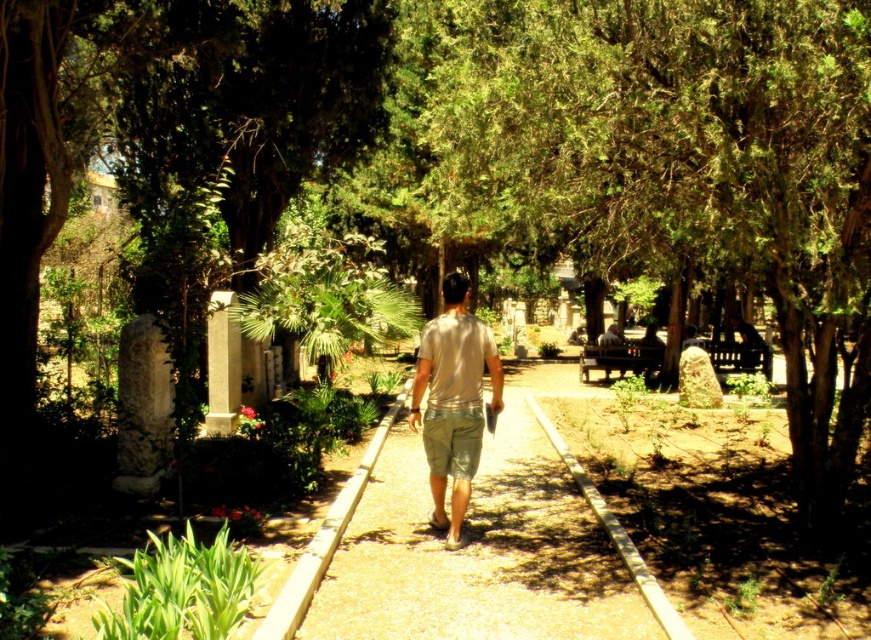
Describe the element at coordinates (487, 554) in the screenshot. Image resolution: width=871 pixels, height=640 pixels. I see `smooth concrete path at center` at that location.

How far apart are smooth concrete path at center and beige cotton shirt at center?

smooth concrete path at center is 31.61 inches from beige cotton shirt at center.

At what (x,y) coordinates should I click in order to perform the action: click on smooth concrete path at center. Please return your answer as a coordinate pair (x, y). Looking at the image, I should click on point(487,554).